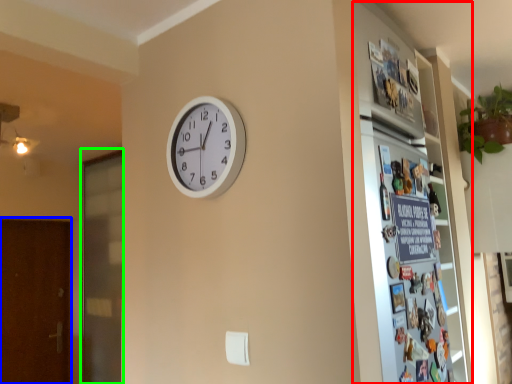
Question: Which object is the closest to the fridge (highlighted by a red box)? Choose among these: screen door (highlighted by a blue box) or screen door (highlighted by a green box).

Choices:
 (A) screen door
 (B) screen door

Answer: (B)